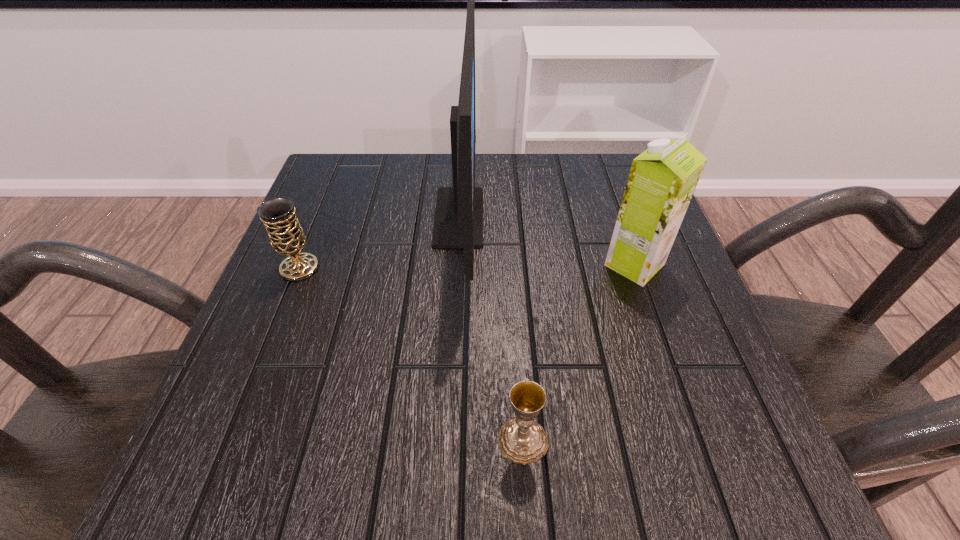
I want to click on vacant area that lies between the rightmost object and the computer monitor, so click(x=547, y=241).

I want to click on free space between the tallest object and the second object from right to left, so click(491, 329).

Where is `free spot between the right chalice and the computer monitor`? The height and width of the screenshot is (540, 960). free spot between the right chalice and the computer monitor is located at coordinates (491, 329).

Locate an element on the screen. This screenshot has width=960, height=540. the third closest object to the leftmost object is located at coordinates (662, 180).

Locate an element on the screen. the second closest object relative to the left chalice is located at coordinates (522, 440).

Identify the location of vacant space that satisfies the following two spatial constraints: 1. on the screen side of the tallest object; 2. on the right side of the rightmost object. The image size is (960, 540). (457, 265).

Where is `free space that satisfies the following two spatial constraints: 1. on the screen side of the computer monitor; 2. on the left side of the third shortest object`? free space that satisfies the following two spatial constraints: 1. on the screen side of the computer monitor; 2. on the left side of the third shortest object is located at coordinates (457, 265).

At what (x,y) coordinates should I click in order to perform the action: click on vacant space that satisfies the following two spatial constraints: 1. on the screen side of the shortest object; 2. on the right side of the second object from left to right. Please return your answer as a coordinate pair (x, y). Looking at the image, I should click on (447, 440).

Find the location of a particular element. The image size is (960, 540). free space that satisfies the following two spatial constraints: 1. on the screen side of the tallest object; 2. on the left side of the nearer chalice is located at coordinates (447, 440).

You are a GUI agent. You are given a task and a screenshot of the screen. Output one action in this format:
    pyautogui.click(x=<x>, y=<y>)
    Task: Click on the free spot that satisfies the following two spatial constraints: 1. on the screen side of the second object from left to right; 2. on the back side of the second tallest object
    
    Given the screenshot: What is the action you would take?
    pyautogui.click(x=457, y=265)